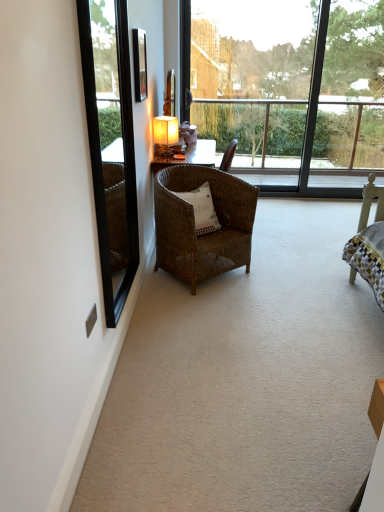
The height and width of the screenshot is (512, 384). What do you see at coordinates (166, 135) in the screenshot?
I see `matte yellow lampshade at center` at bounding box center [166, 135].

Measure the distance between metallic silver power outlet at lower left and camera.

metallic silver power outlet at lower left and camera are 6.01 feet apart.

The image size is (384, 512). What do you see at coordinates (140, 64) in the screenshot? I see `matte black picture frame at upper center` at bounding box center [140, 64].

You are a GUI agent. You are given a task and a screenshot of the screen. Output one action in this format:
    pyautogui.click(x=<x>, y=<y>)
    Task: Click on the matte black picture frame at upper center
    The height and width of the screenshot is (512, 384).
    Given the screenshot: What is the action you would take?
    pyautogui.click(x=140, y=64)

Locate an element on the screen. white woven pillow at center is located at coordinates (202, 209).

At what (x,y) coordinates should I click in order to perform the action: click on woven brown chair at center. Please return your answer as a coordinate pair (x, y). The height and width of the screenshot is (512, 384). Looking at the image, I should click on (194, 224).

You are a GUI agent. You are given a task and a screenshot of the screen. Output one action in this format:
    pyautogui.click(x=<x>, y=<y>)
    Task: Click on the picture frame above the transparent glass window at upper center (from a real-world perspective)
    
    Given the screenshot: What is the action you would take?
    pyautogui.click(x=140, y=64)

How many degrees apart are the facing directions of transparent glass window at upper center and matte black picture frame at upper center?

The angle between the facing direction of transparent glass window at upper center and the facing direction of matte black picture frame at upper center is 89.5 degrees.

Would you say transparent glass window at upper center is inside or outside matte black picture frame at upper center?

transparent glass window at upper center is not inside matte black picture frame at upper center, it's outside.

How much distance is there between transparent glass window at upper center and matte black picture frame at upper center?

transparent glass window at upper center is 8.02 feet from matte black picture frame at upper center.

Does transparent glass window at upper center appear on the right side of matte yellow lampshade at center?

Yes.

Does point (238, 86) come farther from viewer compared to point (169, 146)?

Yes.

Identify the location of window located above the matte yellow lampshade at center (from the image's perspective). Image resolution: width=384 pixels, height=512 pixels. (290, 89).

Is transparent glass window at upper center smaller than matte yellow lampshade at center?

No.

Is matte black picture frame at upper center aimed at woven brown chair at center?

No, matte black picture frame at upper center is not oriented towards woven brown chair at center.

Image resolution: width=384 pixels, height=512 pixels. In order to click on picture frame above the woven brown chair at center (from a real-world perspective) in this screenshot , I will do `click(140, 64)`.

From the picture: Which object is further away from the camera, matte black picture frame at upper center or woven brown chair at center?

woven brown chair at center is further from the camera.

In terms of width, does metallic silver power outlet at lower left look wider or thinner when compared to woven brown chair at center?

Considering their sizes, metallic silver power outlet at lower left looks slimmer than woven brown chair at center.

The width and height of the screenshot is (384, 512). What are the coordinates of `power outlet located above the woven brown chair at center (from a real-world perspective)` in the screenshot? It's located at (91, 320).

Visually, is metallic silver power outlet at lower left positioned to the left or to the right of woven brown chair at center?

From the image, it's evident that metallic silver power outlet at lower left is to the left of woven brown chair at center.

Is metallic silver power outlet at lower left positioned with its back to woven brown chair at center?

That's not correct — metallic silver power outlet at lower left is not looking away from woven brown chair at center.

How far apart are white woven pillow at center and metallic silver power outlet at lower left?

The distance of white woven pillow at center from metallic silver power outlet at lower left is 1.39 meters.

From a real-world perspective, relative to metallic silver power outlet at lower left, is white woven pillow at center vertically above or below?

white woven pillow at center is above metallic silver power outlet at lower left.

Considering the relative sizes of white woven pillow at center and metallic silver power outlet at lower left in the image provided, is white woven pillow at center wider than metallic silver power outlet at lower left?

Indeed, white woven pillow at center has a greater width compared to metallic silver power outlet at lower left.

Does white woven pillow at center appear on the right side of metallic silver power outlet at lower left?

Yes.

In the scene shown: From a real-world perspective, is matte yellow lampshade at center physically below woven brown chair at center?

No.

Between matte yellow lampshade at center and woven brown chair at center, which one has less height?

matte yellow lampshade at center is shorter.

Consider the image. Is woven brown chair at center at the back of matte yellow lampshade at center?

matte yellow lampshade at center does not have its back to woven brown chair at center.

From the picture: Is matte yellow lampshade at center positioned beyond the bounds of white woven pillow at center?

matte yellow lampshade at center lies outside white woven pillow at center's area.

Consider the image. From a real-world perspective, who is located lower, matte yellow lampshade at center or white woven pillow at center?

white woven pillow at center, from a real-world perspective.

Is matte yellow lampshade at center taller or shorter than white woven pillow at center?

Considering their sizes, matte yellow lampshade at center has more height than white woven pillow at center.

Locate an element on the screen. picture frame below the transparent glass window at upper center (from the image's perspective) is located at coordinates (140, 64).

Locate an element on the screen. The image size is (384, 512). window on the right of matte yellow lampshade at center is located at coordinates (290, 89).

From the picture: Based on their spatial positions, is woven brown chair at center or matte yellow lampshade at center closer to black glass mirror at left?

Based on the image, woven brown chair at center appears to be nearer to black glass mirror at left.

Looking at the image, which one is located further to transparent glass window at upper center, white woven pillow at center or woven brown chair at center?

The object further to transparent glass window at upper center is white woven pillow at center.

Estimate the real-world distances between objects in this image. Which object is further from matte black picture frame at upper center, matte yellow lampshade at center or woven brown chair at center?

woven brown chair at center is further to matte black picture frame at upper center.

Which object lies further to the anchor point woven brown chair at center, black glass mirror at left or metallic silver power outlet at lower left?

Based on the image, metallic silver power outlet at lower left appears to be further to woven brown chair at center.

Considering their positions, is transparent glass window at upper center positioned further to matte yellow lampshade at center than woven brown chair at center?

The object further to matte yellow lampshade at center is transparent glass window at upper center.

Looking at the image, which one is located closer to woven brown chair at center, transparent glass window at upper center or matte yellow lampshade at center?

matte yellow lampshade at center.

Consider the image. When comparing their distances from black glass mirror at left, does woven brown chair at center or metallic silver power outlet at lower left seem further?

Among the two, metallic silver power outlet at lower left is located further to black glass mirror at left.

From the picture: Estimate the real-world distances between objects in this image. Which object is closer to transparent glass window at upper center, metallic silver power outlet at lower left or white woven pillow at center?

Based on the image, white woven pillow at center appears to be nearer to transparent glass window at upper center.

Image resolution: width=384 pixels, height=512 pixels. What are the coordinates of `pillow positioned between metallic silver power outlet at lower left and matte yellow lampshade at center from near to far` in the screenshot? It's located at (202, 209).

Identify the location of power outlet between black glass mirror at left and matte yellow lampshade at center in the front-back direction. (91, 320).

Image resolution: width=384 pixels, height=512 pixels. What are the coordinates of `pillow located between metallic silver power outlet at lower left and transparent glass window at upper center in the depth direction` in the screenshot? It's located at (202, 209).

Identify the location of lamp between matte black picture frame at upper center and transparent glass window at upper center in the horizontal direction. (166, 135).